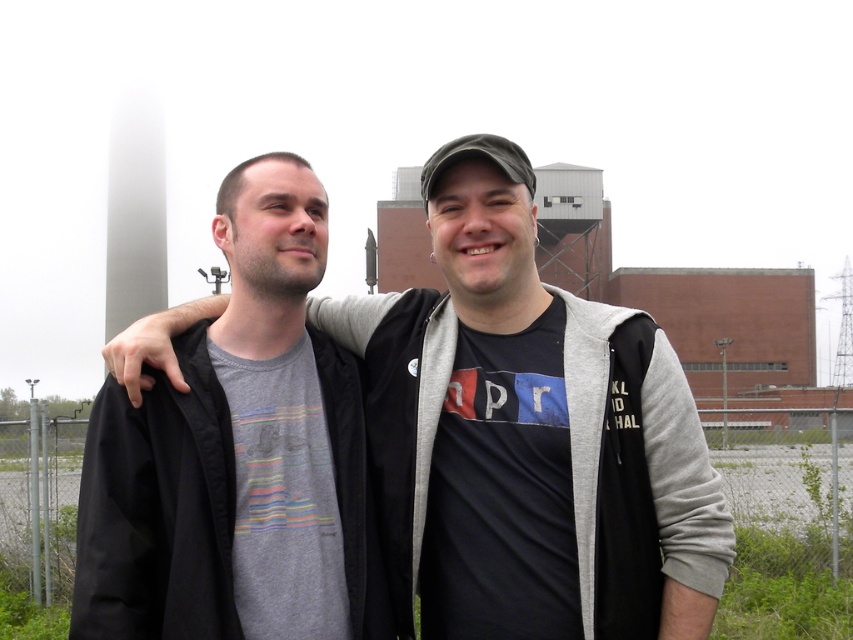
Question: Where is gray cotton t-shirt at center located in relation to gray cotton sweatshirt at left in the image?

Choices:
 (A) below
 (B) above

Answer: (B)

Question: Can you confirm if gray cotton t-shirt at center is positioned above gray cotton sweatshirt at left?

Choices:
 (A) yes
 (B) no

Answer: (A)

Question: Considering the relative positions of gray cotton t-shirt at center and gray cotton sweatshirt at left in the image provided, where is gray cotton t-shirt at center located with respect to gray cotton sweatshirt at left?

Choices:
 (A) left
 (B) right

Answer: (B)

Question: Among these objects, which one is farthest from the camera?

Choices:
 (A) gray cotton sweatshirt at left
 (B) gray cotton t-shirt at center

Answer: (B)

Question: Which of the following is the closest to the observer?

Choices:
 (A) gray cotton t-shirt at center
 (B) gray cotton sweatshirt at left

Answer: (B)